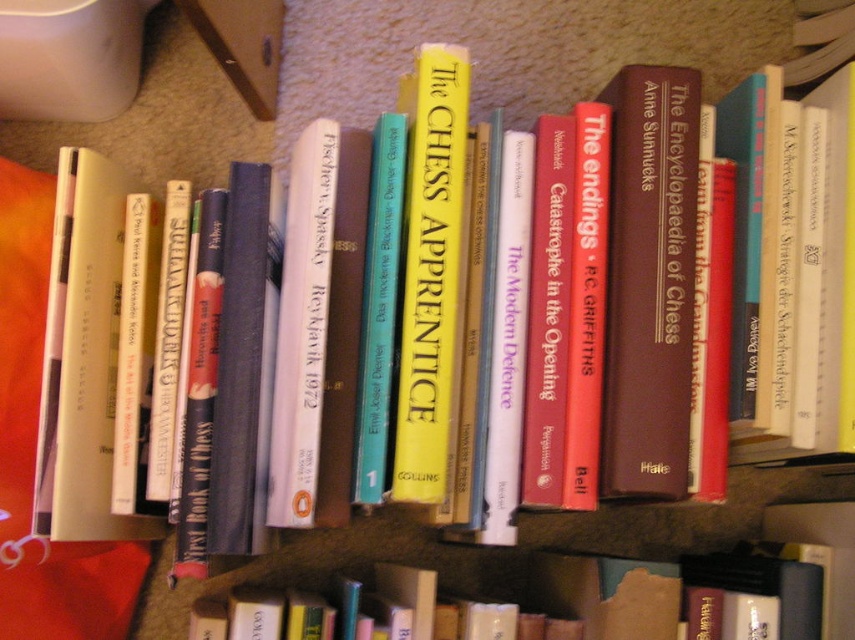
Question: Where is hardcover book at center located in relation to yellow paperback book at center in the image?

Choices:
 (A) left
 (B) right

Answer: (B)

Question: Which object is closer to the camera taking this photo?

Choices:
 (A) white fabric pillow at left
 (B) yellow paperback book at center
 (C) hardcover book at center

Answer: (B)

Question: Is brown hardcover book at center smaller than yellow paperback book at center?

Choices:
 (A) yes
 (B) no

Answer: (B)

Question: Considering the real-world distances, which object is farthest from the yellow paperback book at center?

Choices:
 (A) brown hardcover book at center
 (B) white fabric pillow at left

Answer: (B)

Question: Which object is closer to the camera taking this photo?

Choices:
 (A) brown hardcover book at center
 (B) white fabric pillow at left
 (C) yellow paperback book at center
 (D) hardcover book at center

Answer: (C)

Question: Is brown hardcover book at center below white fabric pillow at left?

Choices:
 (A) yes
 (B) no

Answer: (B)